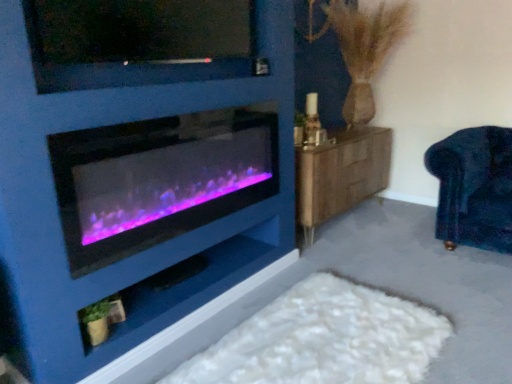
Measure the distance between matte black shelf at lower center and camera.

matte black shelf at lower center is 5.54 feet from camera.

The image size is (512, 384). What do you see at coordinates (324, 339) in the screenshot?
I see `white fluffy rug at lower center` at bounding box center [324, 339].

Find the location of a particular element. This screenshot has width=512, height=384. wooden dresser at right is located at coordinates (340, 174).

The width and height of the screenshot is (512, 384). Describe the element at coordinates (340, 174) in the screenshot. I see `wooden dresser at right` at that location.

Identify the location of purple-lit glass wood burning stove at left. The height and width of the screenshot is (384, 512). (158, 180).

Locate an element on the screen. The image size is (512, 384). velvet dark blue armchair at right is located at coordinates (474, 188).

This screenshot has height=384, width=512. Identify the location of matte black shelf at lower center. (190, 285).

Which object is further away from the camera taking this photo, white fluffy rug at lower center or purple-lit glass wood burning stove at left?

purple-lit glass wood burning stove at left is behind.

Between white fluffy rug at lower center and purple-lit glass wood burning stove at left, which one has larger size?

purple-lit glass wood burning stove at left.

Consider the image. Considering the relative sizes of white fluffy rug at lower center and purple-lit glass wood burning stove at left in the image provided, is white fluffy rug at lower center taller than purple-lit glass wood burning stove at left?

No.

Between purple-lit glass wood burning stove at left and matte black tv at upper center, which one has smaller width?

With smaller width is purple-lit glass wood burning stove at left.

Is purple-lit glass wood burning stove at left looking in the opposite direction of matte black tv at upper center?

No.

The width and height of the screenshot is (512, 384). I want to click on tv show in front of the purple-lit glass wood burning stove at left, so click(x=138, y=42).

How different are the orientations of purple-lit glass wood burning stove at left and matte black tv at upper center in degrees?

The angle between the facing direction of purple-lit glass wood burning stove at left and the facing direction of matte black tv at upper center is 0.376 degrees.

Is white fluffy rug at lower center inside wooden dresser at right?

No, white fluffy rug at lower center is not inside wooden dresser at right.

From the image's perspective, between wooden dresser at right and white fluffy rug at lower center, which one is located above?

wooden dresser at right is shown above in the image.

Is point (339, 144) positioned behind point (383, 368)?

Yes.

How many degrees apart are the facing directions of wooden dresser at right and white fluffy rug at lower center?

There is a 1.07-degree angle between the facing directions of wooden dresser at right and white fluffy rug at lower center.

Visually, is wooden dresser at right positioned to the left or to the right of matte black tv at upper center?

wooden dresser at right is positioned on matte black tv at upper center's right side.

Consider the image. From a real-world perspective, is wooden dresser at right positioned over matte black tv at upper center based on gravity?

No, from a real-world perspective, wooden dresser at right is not over matte black tv at upper center

Considering their positions, is wooden dresser at right located in front of or behind matte black tv at upper center?

In the image, wooden dresser at right appears behind matte black tv at upper center.

Consider the image. Could matte black tv at upper center be considered to be inside wooden dresser at right?

No, wooden dresser at right does not contain matte black tv at upper center.

Looking at this image, which object is thinner, velvet dark blue armchair at right or purple-lit glass wood burning stove at left?

purple-lit glass wood burning stove at left.

In the image, is velvet dark blue armchair at right positioned in front of or behind purple-lit glass wood burning stove at left?

Visually, velvet dark blue armchair at right is located behind purple-lit glass wood burning stove at left.

Can purple-lit glass wood burning stove at left be found inside velvet dark blue armchair at right?

No, purple-lit glass wood burning stove at left is not inside velvet dark blue armchair at right.

Is velvet dark blue armchair at right taller than purple-lit glass wood burning stove at left?

Indeed, velvet dark blue armchair at right has a greater height compared to purple-lit glass wood burning stove at left.

Can you confirm if purple-lit glass wood burning stove at left is wider than matte black shelf at lower center?

In fact, purple-lit glass wood burning stove at left might be narrower than matte black shelf at lower center.

Looking at this image, from the image's perspective, is purple-lit glass wood burning stove at left on top of matte black shelf at lower center?

Indeed, from the image's perspective, purple-lit glass wood burning stove at left is shown above matte black shelf at lower center.

Are purple-lit glass wood burning stove at left and matte black shelf at lower center far apart?

They are positioned close to each other.

Is purple-lit glass wood burning stove at left oriented away from matte black shelf at lower center?

No.

Considering the sizes of matte black shelf at lower center and velvet dark blue armchair at right in the image, is matte black shelf at lower center wider or thinner than velvet dark blue armchair at right?

Considering their sizes, matte black shelf at lower center looks slimmer than velvet dark blue armchair at right.

Would you say matte black shelf at lower center is outside velvet dark blue armchair at right?

Yes, matte black shelf at lower center is located beyond the bounds of velvet dark blue armchair at right.

From their relative heights in the image, would you say matte black shelf at lower center is taller or shorter than velvet dark blue armchair at right?

matte black shelf at lower center is shorter than velvet dark blue armchair at right.

Is point (129, 295) closer to camera compared to point (466, 219)?

Yes.

Locate an element on the screen. The width and height of the screenshot is (512, 384). dog bed in front of the purple-lit glass wood burning stove at left is located at coordinates (324, 339).

At what (x,y) coordinates should I click in order to perform the action: click on wood burning stove that appears below the matte black tv at upper center (from the image's perspective). Please return your answer as a coordinate pair (x, y). The height and width of the screenshot is (384, 512). Looking at the image, I should click on (158, 180).

Which object lies nearer to the anchor point purple-lit glass wood burning stove at left, matte black shelf at lower center or white fluffy rug at lower center?

The object closer to purple-lit glass wood burning stove at left is matte black shelf at lower center.

Based on their spatial positions, is velvet dark blue armchair at right or matte black tv at upper center further from purple-lit glass wood burning stove at left?

velvet dark blue armchair at right is further to purple-lit glass wood burning stove at left.

Based on their spatial positions, is purple-lit glass wood burning stove at left or wooden dresser at right further from matte black shelf at lower center?

wooden dresser at right is positioned further to the anchor matte black shelf at lower center.

Which object lies nearer to the anchor point purple-lit glass wood burning stove at left, velvet dark blue armchair at right or matte black shelf at lower center?

matte black shelf at lower center is positioned closer to the anchor purple-lit glass wood burning stove at left.

Looking at the image, which one is located closer to wooden dresser at right, matte black tv at upper center or velvet dark blue armchair at right?

velvet dark blue armchair at right.

Considering their positions, is purple-lit glass wood burning stove at left positioned further to matte black shelf at lower center than velvet dark blue armchair at right?

The object further to matte black shelf at lower center is velvet dark blue armchair at right.

From the image, which object appears to be farther from matte black tv at upper center, white fluffy rug at lower center or velvet dark blue armchair at right?

velvet dark blue armchair at right is further to matte black tv at upper center.

Which object lies nearer to the anchor point velvet dark blue armchair at right, purple-lit glass wood burning stove at left or wooden dresser at right?

wooden dresser at right.

At what (x,y) coordinates should I click in order to perform the action: click on furniture between white fluffy rug at lower center and wooden dresser at right along the z-axis. Please return your answer as a coordinate pair (x, y). The image size is (512, 384). Looking at the image, I should click on (474, 188).

Locate an element on the screen. wood burning stove between matte black tv at upper center and white fluffy rug at lower center vertically is located at coordinates (158, 180).

At what (x,y) coordinates should I click in order to perform the action: click on wood burning stove between matte black tv at upper center and wooden dresser at right in the front-back direction. Please return your answer as a coordinate pair (x, y). Image resolution: width=512 pixels, height=384 pixels. Looking at the image, I should click on (158, 180).

Locate an element on the screen. The width and height of the screenshot is (512, 384). dog bed between matte black tv at upper center and velvet dark blue armchair at right is located at coordinates (324, 339).